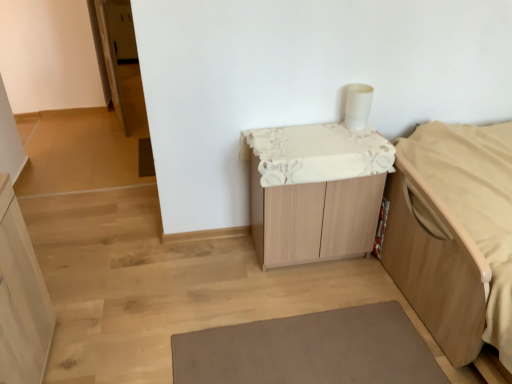
I want to click on unoccupied area behind light wood cabinet at left, so click(x=90, y=300).